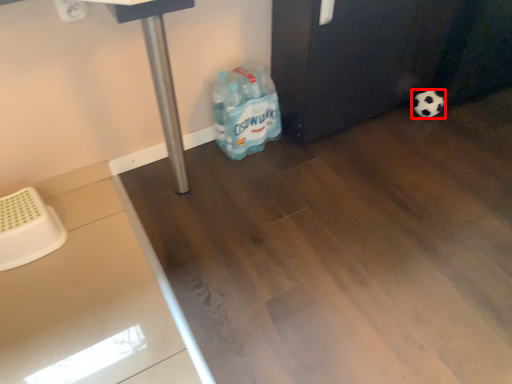
Question: From the image's perspective, where is football (annotated by the red box) located in relation to cleaning product in the image?

Choices:
 (A) above
 (B) below

Answer: (A)